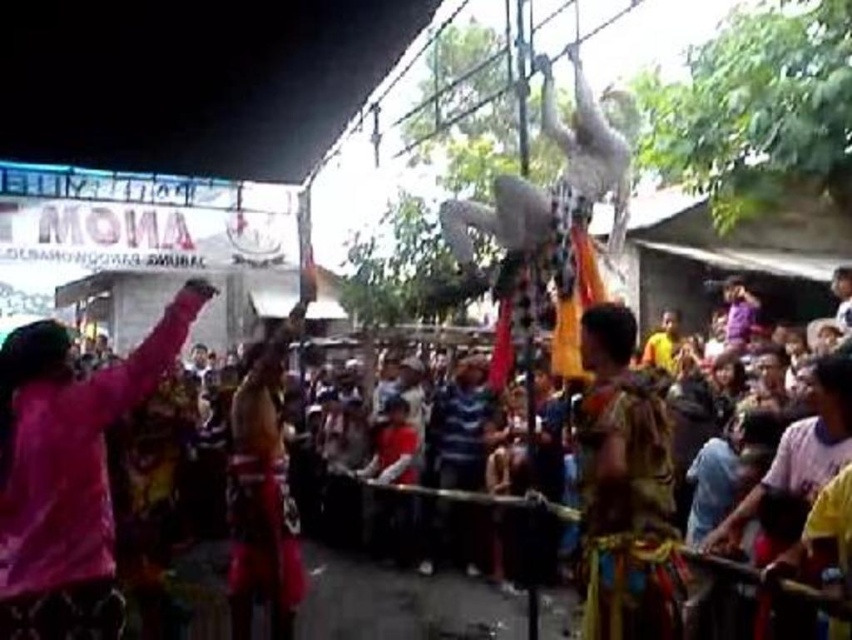
You are a photographer at the festival. You want to capture a photo that includes both the purple fabric at left and the multicolored fabric crowd at center. Which fabric should you focus on first to ensure it takes up more space in the photo?

The purple fabric at left is larger in size than the multicolored fabric crowd at center, so focusing on the purple fabric at left first will ensure it takes up more space in the photo.

You are a photographer at the festival and want to capture a photo that includes both the purple fabric at left and the multicolored fabric crowd at center. Based on their positions, which object should you place closer to the left edge of your camera frame?

The purple fabric at left should be placed closer to the left edge of your camera frame since it is positioned on the left side of the multicolored fabric crowd at center.